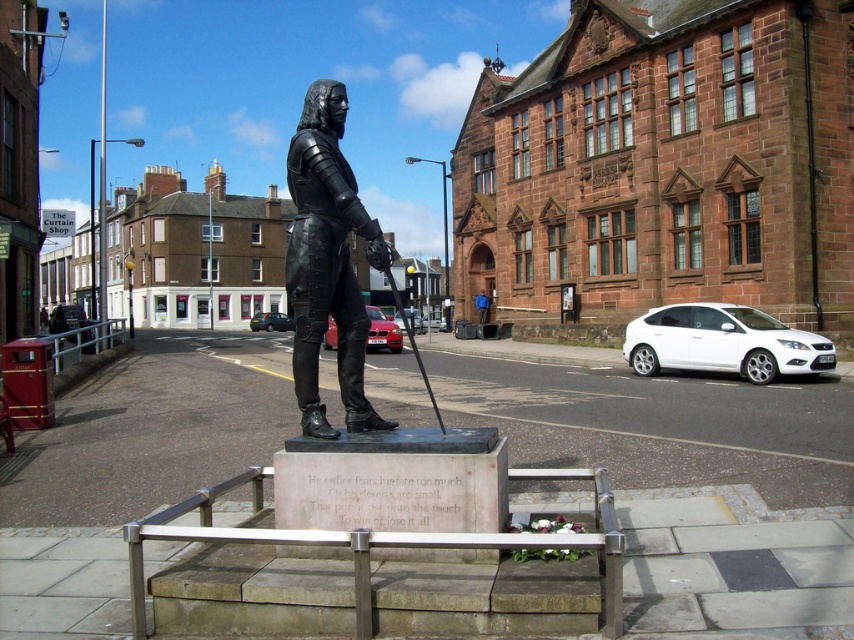
Which is more to the left, black polished bronze statue at center or blue fabric jacket at center?

black polished bronze statue at center is more to the left.

This screenshot has height=640, width=854. I want to click on black polished bronze statue at center, so click(x=326, y=262).

Locate an element on the screen. The height and width of the screenshot is (640, 854). black polished bronze statue at center is located at coordinates (326, 262).